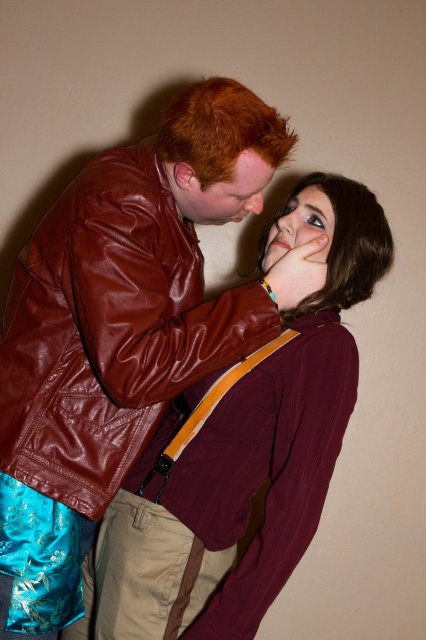
Question: Which of the following is the closest to the observer?

Choices:
 (A) smooth brown hair at upper center
 (B) shiny brown leather jacket at upper left

Answer: (B)

Question: Observing the image, what is the correct spatial positioning of shiny brown leather jacket at upper left in reference to smooth brown hair at upper center?

Choices:
 (A) left
 (B) right

Answer: (A)

Question: Which of the following is the farthest from the observer?

Choices:
 (A) smooth brown hair at upper center
 (B) shiny brown leather jacket at upper left

Answer: (A)

Question: Which object is farther from the camera taking this photo?

Choices:
 (A) smooth brown hair at upper center
 (B) shiny brown leather jacket at upper left

Answer: (A)

Question: From the image, what is the correct spatial relationship of shiny brown leather jacket at upper left in relation to smooth brown hair at upper center?

Choices:
 (A) below
 (B) above

Answer: (A)

Question: Does shiny brown leather jacket at upper left appear under smooth brown hair at upper center?

Choices:
 (A) yes
 (B) no

Answer: (A)